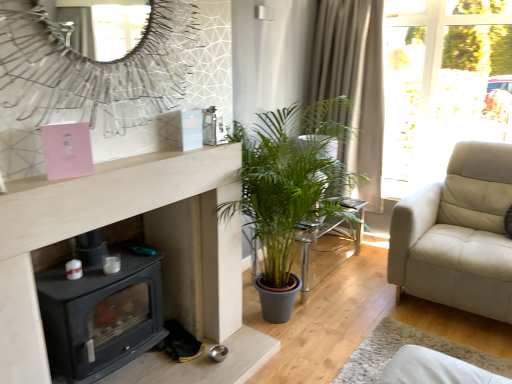
Question: From a real-world perspective, is black matte wood burning stove at lower left over metallic silver mirror at upper center?

Choices:
 (A) no
 (B) yes

Answer: (A)

Question: Does black matte wood burning stove at lower left have a greater width compared to metallic silver mirror at upper center?

Choices:
 (A) no
 (B) yes

Answer: (B)

Question: Is metallic silver mirror at upper center completely or partially inside black matte wood burning stove at lower left?

Choices:
 (A) no
 (B) yes

Answer: (A)

Question: Can you confirm if black matte wood burning stove at lower left is shorter than metallic silver mirror at upper center?

Choices:
 (A) no
 (B) yes

Answer: (A)

Question: Is black matte wood burning stove at lower left oriented away from metallic silver mirror at upper center?

Choices:
 (A) no
 (B) yes

Answer: (A)

Question: From a real-world perspective, relative to black matte wood burning stove at lower left, is beige textured curtain at upper right vertically above or below?

Choices:
 (A) above
 (B) below

Answer: (A)

Question: From the image's perspective, is beige textured curtain at upper right positioned above or below black matte wood burning stove at lower left?

Choices:
 (A) below
 (B) above

Answer: (B)

Question: In terms of height, does beige textured curtain at upper right look taller or shorter compared to black matte wood burning stove at lower left?

Choices:
 (A) short
 (B) tall

Answer: (B)

Question: Would you say beige textured curtain at upper right is to the left or to the right of black matte wood burning stove at lower left in the picture?

Choices:
 (A) right
 (B) left

Answer: (A)

Question: Is point (312, 259) positioned closer to the camera than point (156, 319)?

Choices:
 (A) closer
 (B) farther

Answer: (B)

Question: Which is correct: translucent glass table at center is inside black matte wood burning stove at lower left, or outside of it?

Choices:
 (A) outside
 (B) inside

Answer: (A)

Question: In the image, is translucent glass table at center on the left side or the right side of black matte wood burning stove at lower left?

Choices:
 (A) left
 (B) right

Answer: (B)

Question: From the image's perspective, is translucent glass table at center above or below black matte wood burning stove at lower left?

Choices:
 (A) below
 (B) above

Answer: (B)

Question: Is beige textured curtain at upper right bigger or smaller than translucent glass table at center?

Choices:
 (A) big
 (B) small

Answer: (A)

Question: From the image's perspective, relative to translucent glass table at center, is beige textured curtain at upper right above or below?

Choices:
 (A) below
 (B) above

Answer: (B)